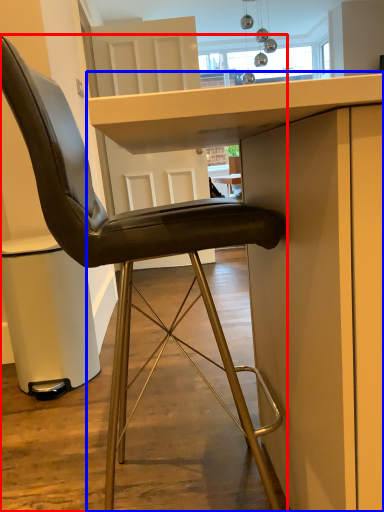
Question: Among these objects, which one is nearest to the camera, chair (highlighted by a red box) or table (highlighted by a blue box)?

Choices:
 (A) chair
 (B) table

Answer: (B)